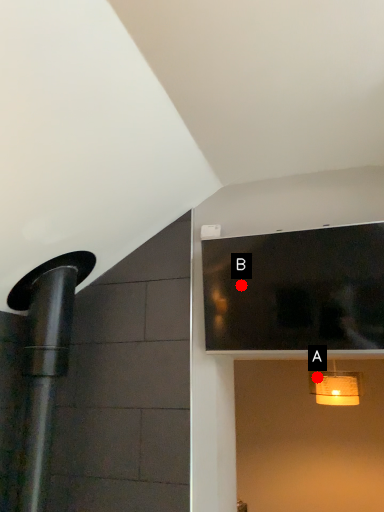
Question: Two points are circled on the image, labeled by A and B beside each circle. Which point is closer to the camera?

Choices:
 (A) A is closer
 (B) B is closer

Answer: (B)